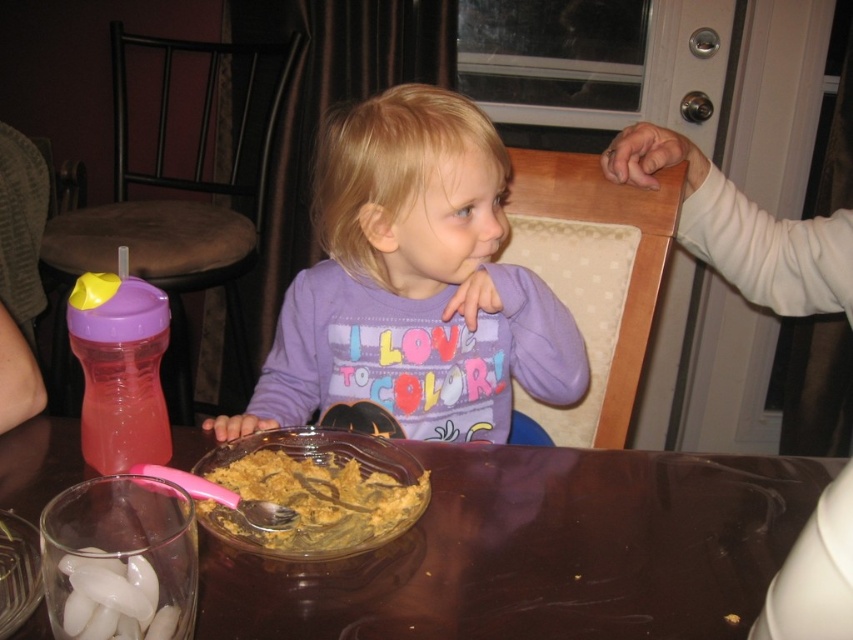
Question: Can you confirm if transparent glass bowl at center is bigger than white rubber teether at lower left?

Choices:
 (A) no
 (B) yes

Answer: (B)

Question: Can you confirm if transparent glass bowl at center is smaller than brown crumbly food at center?

Choices:
 (A) no
 (B) yes

Answer: (A)

Question: Estimate the real-world distances between objects in this image. Which object is closer to the brown crumbly food at center?

Choices:
 (A) white rubber teether at lower left
 (B) purple soft cotton shirt at center
 (C) transparent glass bowl at center

Answer: (C)

Question: Is purple soft cotton shirt at center above brown crumbly food at center?

Choices:
 (A) yes
 (B) no

Answer: (A)

Question: Which object is positioned closest to the brown crumbly food at center?

Choices:
 (A) purple soft cotton shirt at center
 (B) white rubber teether at lower left
 (C) transparent glass bowl at center

Answer: (C)

Question: Which point is closer to the camera?

Choices:
 (A) (335, 497)
 (B) (373, 196)
 (C) (505, 588)
 (D) (160, 616)

Answer: (D)